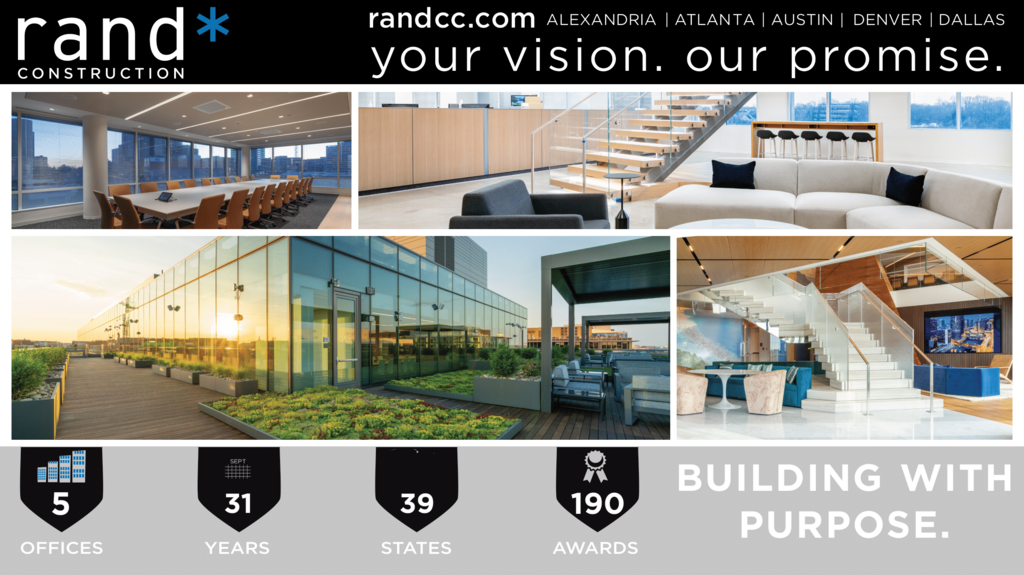
At what (x,y) coordinates should I click in order to perform the action: click on meeting room table. Please return your answer as a coordinate pair (x, y). This screenshot has height=575, width=1024. Looking at the image, I should click on (200, 195).